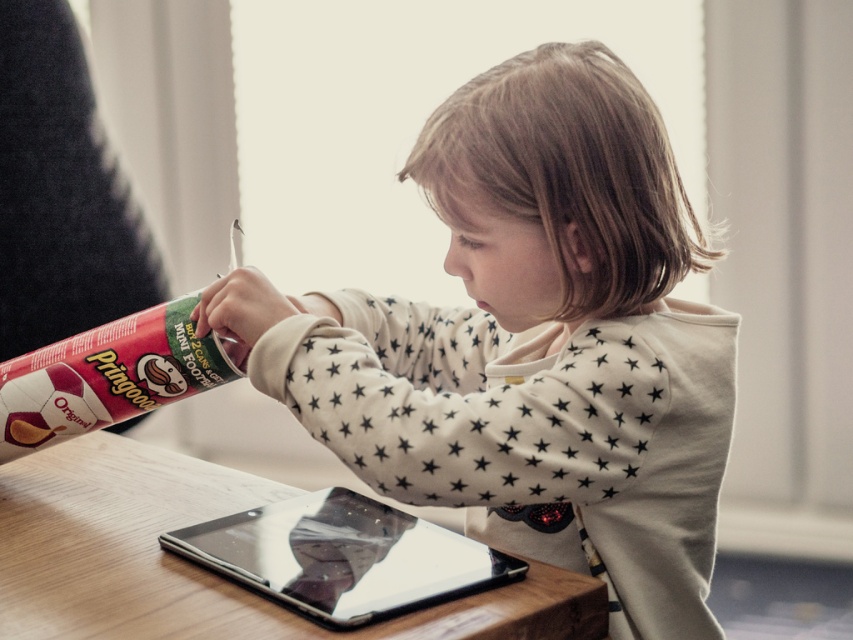
Based on the photo, you are a delivery robot with a package that needs to be placed on the table. The package is 1.2 meters long. There is a point at (398, 349) on the table. Can you place the package so that it extends from the edge of the table to this point?

The distance between the edge of the table and the point at (398, 349) is 1.19 meters. Since the package is 1.2 meters long, it is slightly too long to fit from the edge to the point. You may need to adjust the placement to ensure it fits entirely on the table.

You are a parent trying to set up a snack for your child. The wooden table at center has a height of 70 cm. The transparent plastic tablet at center is placed on the table. If the child is 100 cm tall, can they comfortably reach the tablet?

The wooden table at center is taller than the transparent plastic tablet at center. Since the table is 70 cm tall and the tablet is placed on it, the tablet would be at least 70 cm high. The child is 100 cm tall, so they can comfortably reach the tablet as it is within their height range.